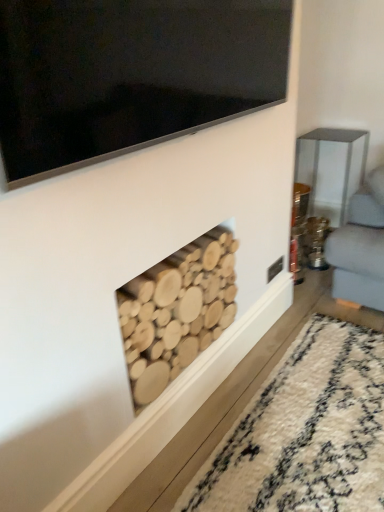
Question: In the image, is natural wood logs at center positioned in front of or behind black glossy tv at upper center?

Choices:
 (A) front
 (B) behind

Answer: (B)

Question: From the image's perspective, is natural wood logs at center above or below black glossy tv at upper center?

Choices:
 (A) below
 (B) above

Answer: (A)

Question: From a real-world perspective, is natural wood logs at center above or below black glossy tv at upper center?

Choices:
 (A) above
 (B) below

Answer: (B)

Question: From a real-world perspective, is black glossy tv at upper center above or below natural wood logs at center?

Choices:
 (A) above
 (B) below

Answer: (A)

Question: In the image, is black glossy tv at upper center positioned in front of or behind natural wood logs at center?

Choices:
 (A) behind
 (B) front

Answer: (B)

Question: Is black glossy tv at upper center to the left or to the right of natural wood logs at center in the image?

Choices:
 (A) right
 (B) left

Answer: (A)

Question: Considering the positions of black glossy tv at upper center and natural wood logs at center in the image, is black glossy tv at upper center taller or shorter than natural wood logs at center?

Choices:
 (A) short
 (B) tall

Answer: (A)